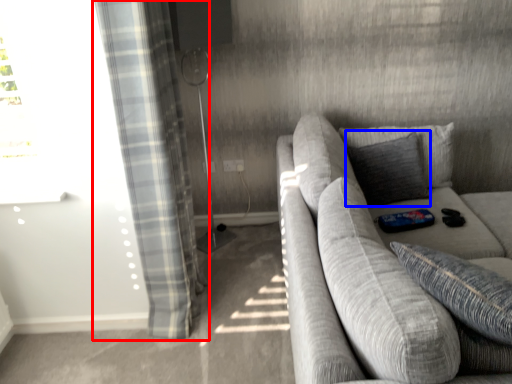
Question: Which of the following is the farthest to the observer, curtain (highlighted by a red box) or pillow (highlighted by a blue box)?

Choices:
 (A) curtain
 (B) pillow

Answer: (B)